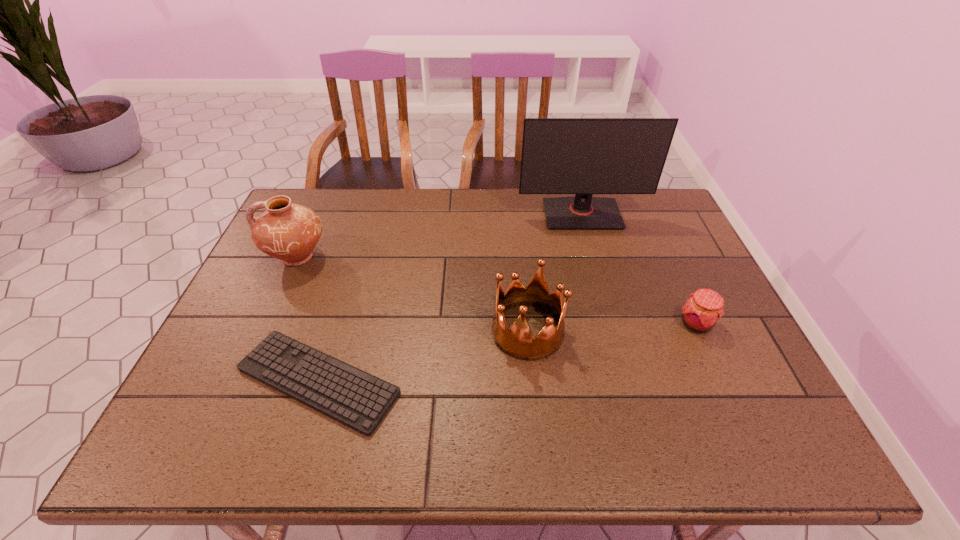
Find the location of `vacant area between the crown and the fourth tallest object`. vacant area between the crown and the fourth tallest object is located at coordinates (612, 328).

Choose which object is the third nearest neighbor to the shortest object. Please provide its 2D coordinates. Your answer should be formatted as a tuple, i.e. [(x, y)], where the tuple contains the x and y coordinates of a point satisfying the conditions above.

[(583, 156)]

I want to click on object that stands as the second closest to the monitor, so click(704, 308).

This screenshot has width=960, height=540. I want to click on vacant space that satisfies the following two spatial constraints: 1. on the screen side of the monitor; 2. on the right side of the jam, so point(612,324).

Where is `free region that satisfies the following two spatial constraints: 1. on the back side of the computer keyboard; 2. on the left side of the jam`? The image size is (960, 540). free region that satisfies the following two spatial constraints: 1. on the back side of the computer keyboard; 2. on the left side of the jam is located at coordinates (335, 324).